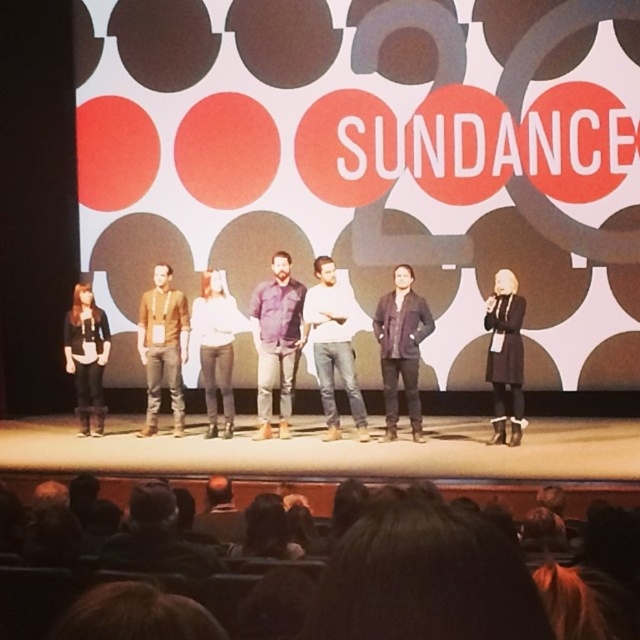
Does purple cotton shirt at center have a lesser width compared to white matte shirt at center?

In fact, purple cotton shirt at center might be wider than white matte shirt at center.

Identify the location of purple cotton shirt at center. (276, 340).

Does point (492, 426) come closer to viewer compared to point (228, 365)?

That is True.

Between point (492, 348) and point (211, 330), which one is positioned in front?

Point (492, 348) is more forward.

Describe the element at coordinates (506, 355) in the screenshot. I see `black leather jacket at right` at that location.

You are a GUI agent. You are given a task and a screenshot of the screen. Output one action in this format:
    pyautogui.click(x=<x>, y=<y>)
    Task: Click on the black leather jacket at right
    The height and width of the screenshot is (640, 640).
    Given the screenshot: What is the action you would take?
    pyautogui.click(x=506, y=355)

Can you confirm if white cotton shirt at center is thinner than black leather jacket at right?

No.

Who is higher up, white cotton shirt at center or black leather jacket at right?

white cotton shirt at center is higher up.

Does point (330, 276) come in front of point (518, 440)?

No, (330, 276) is further to viewer.

Identify the location of white cotton shirt at center. (332, 348).